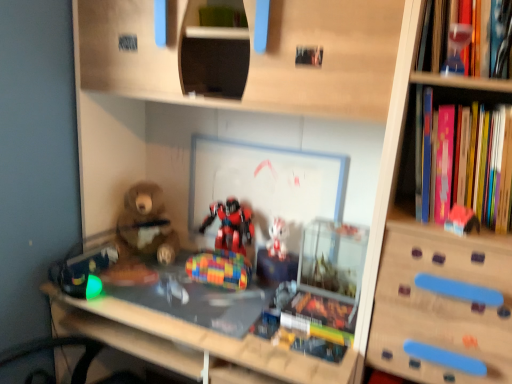
Question: From a real-world perspective, is hardcover book at center, placed as the first book when sorted from bottom to top, located higher than clear glass table at center?

Choices:
 (A) yes
 (B) no

Answer: (A)

Question: From a real-world perspective, is hardcover book at center, arranged as the 2th book when viewed from the top, below clear glass table at center?

Choices:
 (A) no
 (B) yes

Answer: (A)

Question: Can you confirm if hardcover book at center, arranged as the 2th book when viewed from the top, is wider than clear glass table at center?

Choices:
 (A) yes
 (B) no

Answer: (B)

Question: Is hardcover book at center, placed as the first book when sorted from bottom to top, not near clear glass table at center?

Choices:
 (A) yes
 (B) no

Answer: (B)

Question: Can you confirm if hardcover book at center, which is the 1th book in left-to-right order, is smaller than clear glass table at center?

Choices:
 (A) no
 (B) yes

Answer: (B)

Question: Is multicolored plastic cube at center, the second toy from the left, in front of or behind white plush toy at center, the 4th toy positioned from the left, in the image?

Choices:
 (A) behind
 (B) front

Answer: (B)

Question: From a real-world perspective, relative to white plush toy at center, which is the third toy in right-to-left order, is multicolored plastic cube at center, the 4th toy when ordered from back to front, vertically above or below?

Choices:
 (A) below
 (B) above

Answer: (A)

Question: Would you say multicolored plastic cube at center, the fifth toy when ordered from right to left, is to the left or to the right of white plush toy at center, placed as the 2th toy when sorted from back to front, in the picture?

Choices:
 (A) left
 (B) right

Answer: (A)

Question: From their relative heights in the image, would you say multicolored plastic cube at center, acting as the 3th toy starting from the front, is taller or shorter than white plush toy at center, placed as the 2th toy when sorted from back to front?

Choices:
 (A) short
 (B) tall

Answer: (A)

Question: Is pink plastic toy at right, acting as the 2th toy starting from the front, wider or thinner than clear glass table at center?

Choices:
 (A) wide
 (B) thin

Answer: (B)

Question: From a real-world perspective, is pink plastic toy at right, the 5th toy from the back, positioned above or below clear glass table at center?

Choices:
 (A) below
 (B) above

Answer: (B)

Question: Is point click(x=468, y=221) closer or farther from the camera than point click(x=250, y=362)?

Choices:
 (A) closer
 (B) farther

Answer: (A)

Question: From the image's perspective, is pink plastic toy at right, acting as the 2th toy starting from the front, positioned above or below clear glass table at center?

Choices:
 (A) below
 (B) above

Answer: (B)

Question: From a real-world perspective, is transparent glass hourglass at upper right, the 1th toy when ordered from front to back, above or below hardcover book at center, arranged as the 2th book when viewed from the top?

Choices:
 (A) below
 (B) above

Answer: (B)

Question: Is transparent glass hourglass at upper right, the 1th toy when ordered from front to back, wider or thinner than hardcover book at center, marked as the second book in a right-to-left arrangement?

Choices:
 (A) thin
 (B) wide

Answer: (A)